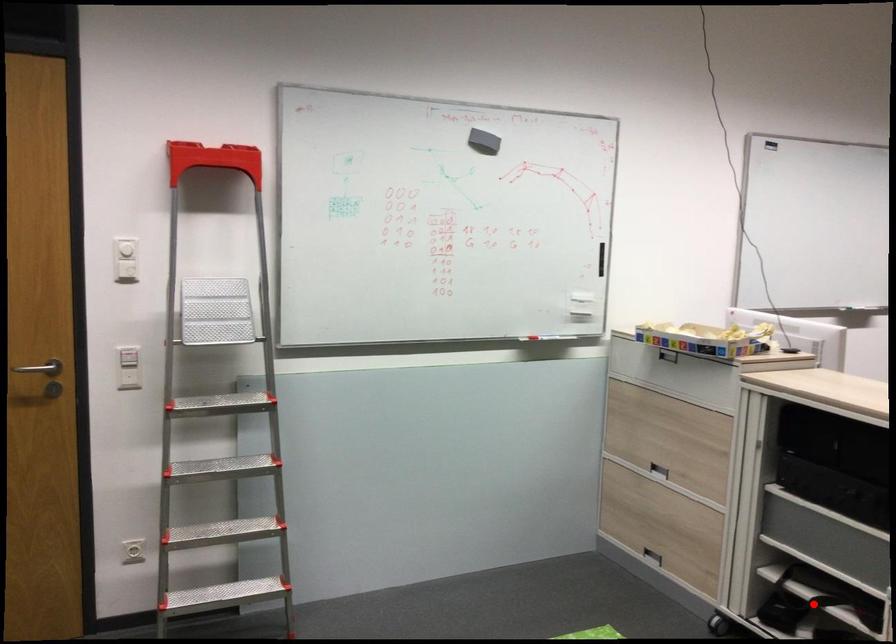
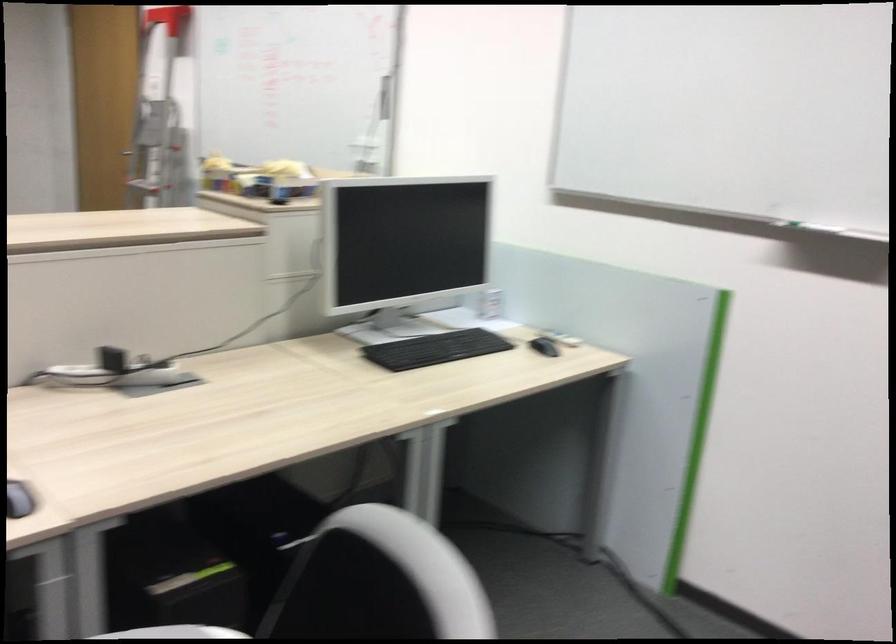
Question: I am providing you with two images of the same scene from different viewpoints. A red point is marked on the first image. At the location where the point appears in image 1, is it still visible in image 2?

Choices:
 (A) Yes
 (B) No

Answer: (B)